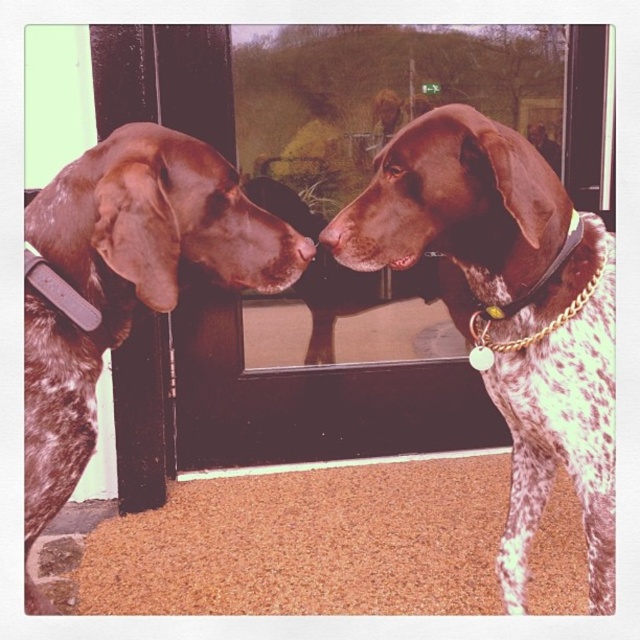
Question: Which object appears farthest from the camera in this image?

Choices:
 (A) gold chain collar at right
 (B) brown leather nose at center
 (C) speckled fur dog at center
 (D) speckled brown dog at left

Answer: (A)

Question: Which point is farther to the camera?

Choices:
 (A) (572, 248)
 (B) (316, 244)
 (C) (376, 298)

Answer: (C)

Question: Is speckled fur dog at center thinner than gold chain collar at right?

Choices:
 (A) no
 (B) yes

Answer: (A)

Question: Is the position of gold chain collar at right more distant than that of brown leather nose at center?

Choices:
 (A) no
 (B) yes

Answer: (B)

Question: Which point is farther to the camera?

Choices:
 (A) (301, 285)
 (B) (33, 509)
 (C) (516, 307)

Answer: (A)

Question: Does transparent glass window at center appear on the left side of brown leather nose at center?

Choices:
 (A) no
 (B) yes

Answer: (A)